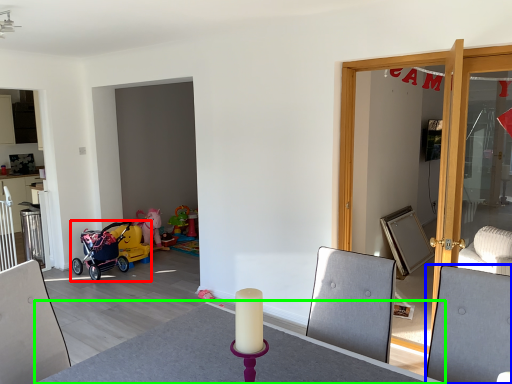
Question: Estimate the real-world distances between objects in this image. Which object is farther from stroller (highlighted by a red box), swivel chair (highlighted by a blue box) or round table (highlighted by a green box)?

Choices:
 (A) swivel chair
 (B) round table

Answer: (A)